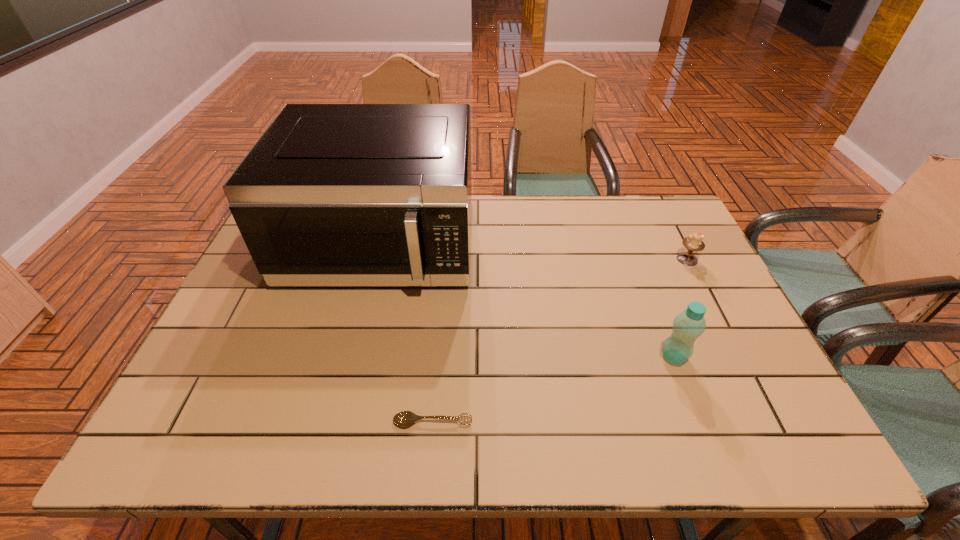
Identify the location of vacant space situated on the back of the ladle. (444, 298).

Where is `object present at the far edge`? The width and height of the screenshot is (960, 540). object present at the far edge is located at coordinates (331, 194).

The image size is (960, 540). I want to click on object present at the near edge, so click(404, 418).

Locate an element on the screen. The image size is (960, 540). object at the left edge is located at coordinates (331, 194).

This screenshot has height=540, width=960. What are the coordinates of `object that is at the right edge` in the screenshot? It's located at (693, 242).

I want to click on object located at the far left corner, so click(331, 194).

Where is `free spot at the far edge of the desktop`? The width and height of the screenshot is (960, 540). free spot at the far edge of the desktop is located at coordinates (603, 215).

In the image, there is a desktop. Find the location of `free space at the near edge`. free space at the near edge is located at coordinates (292, 452).

At what (x,y) coordinates should I click in order to perform the action: click on free spot at the left edge of the desktop. Please return your answer as a coordinate pair (x, y). Looking at the image, I should click on (276, 299).

Locate an element on the screen. This screenshot has height=540, width=960. free space at the right edge of the desktop is located at coordinates (727, 344).